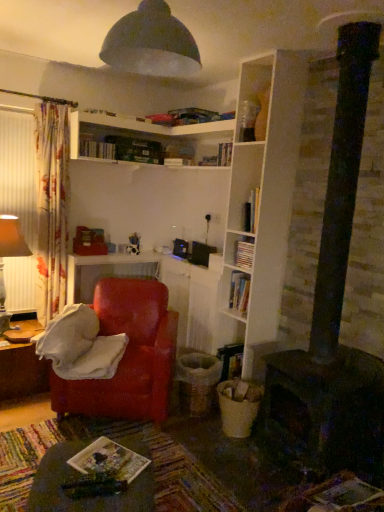
The height and width of the screenshot is (512, 384). Find the location of `empty space that is ontop of wooden board game at lower center, which is counted as the third book, starting from the top`. empty space that is ontop of wooden board game at lower center, which is counted as the third book, starting from the top is located at coordinates (112, 458).